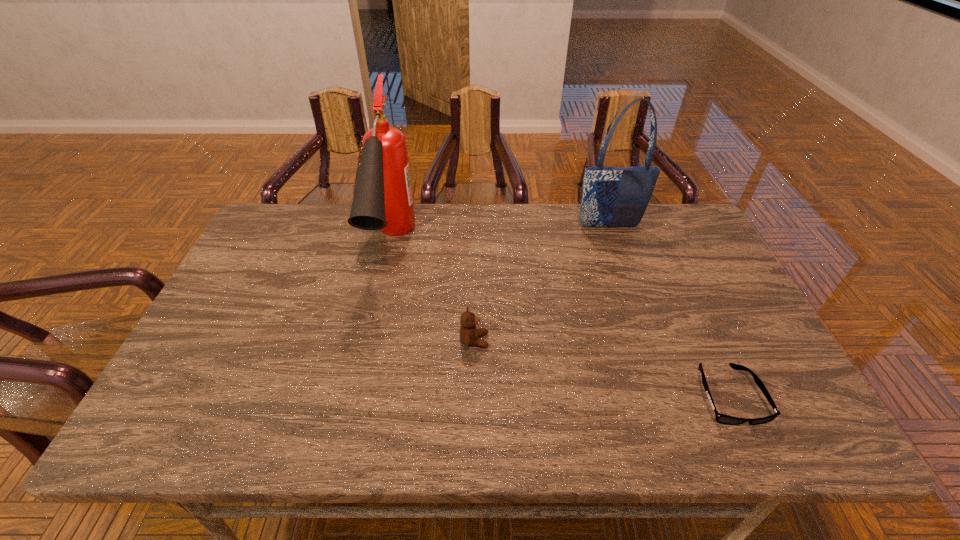
The width and height of the screenshot is (960, 540). I want to click on shopping bag at the far edge, so click(x=612, y=197).

Identify the location of object that is at the near edge. (x=720, y=418).

Image resolution: width=960 pixels, height=540 pixels. I want to click on object that is at the right edge, so click(x=720, y=418).

Where is `object that is positioned at the near right corner`? The width and height of the screenshot is (960, 540). object that is positioned at the near right corner is located at coordinates (720, 418).

At what (x,y) coordinates should I click in order to perform the action: click on vacant area at the far edge. Please return your answer as a coordinate pair (x, y). The height and width of the screenshot is (540, 960). Looking at the image, I should click on (509, 216).

The width and height of the screenshot is (960, 540). Identify the location of blank area at the near edge. (x=216, y=444).

Locate an element on the screen. This screenshot has width=960, height=540. free region at the left edge of the desktop is located at coordinates (242, 263).

Find the location of a particular element. Image resolution: width=960 pixels, height=540 pixels. free space at the right edge of the desktop is located at coordinates (728, 292).

Image resolution: width=960 pixels, height=540 pixels. Find the location of `free space at the far left corner of the desktop`. free space at the far left corner of the desktop is located at coordinates (285, 219).

Find the location of a particular element. free space at the far right corner of the desktop is located at coordinates (660, 213).